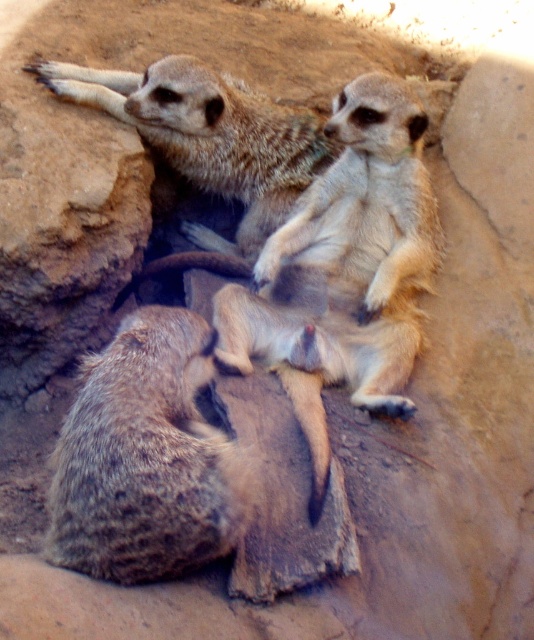
Is brown fuzzy meerkat at lower left positioned behind fuzzy brown meerkat at upper center?

That is False.

Who is shorter, brown fuzzy meerkat at lower left or fuzzy brown meerkat at upper center?

With less height is brown fuzzy meerkat at lower left.

Describe the element at coordinates (145, 458) in the screenshot. I see `brown fuzzy meerkat at lower left` at that location.

The image size is (534, 640). What are the coordinates of `brown fuzzy meerkat at lower left` in the screenshot? It's located at (145, 458).